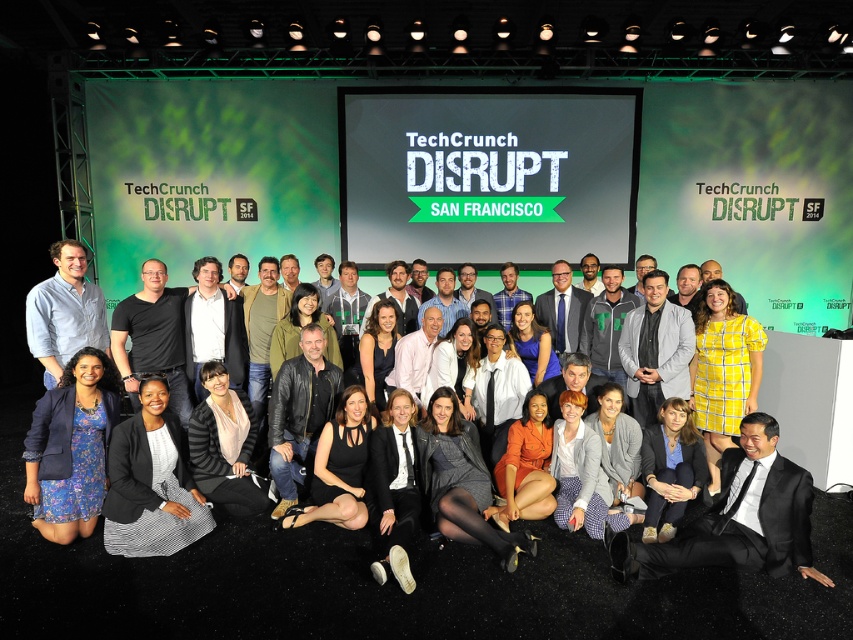
Does black satin suit at lower right appear on the right side of matte blue shirt at left?

Correct, you'll find black satin suit at lower right to the right of matte blue shirt at left.

Consider the image. Can you confirm if black satin suit at lower right is taller than matte blue shirt at left?

In fact, black satin suit at lower right may be shorter than matte blue shirt at left.

Between point (689, 548) and point (85, 252), which one is positioned in front?

Point (689, 548) is more forward.

The image size is (853, 640). Find the location of `black satin suit at lower right`. black satin suit at lower right is located at coordinates (738, 516).

Between point (693, 557) and point (68, 451), which one is positioned in front?

Point (693, 557)

Identify the location of black satin suit at lower right. (738, 516).

The width and height of the screenshot is (853, 640). Find the location of `black satin suit at lower right`. black satin suit at lower right is located at coordinates (738, 516).

Which is more to the left, gray fabric jacket at center or matte blue shirt at left?

From the viewer's perspective, matte blue shirt at left appears more on the left side.

Who is shorter, gray fabric jacket at center or matte blue shirt at left?

With less height is matte blue shirt at left.

Consider the image. Who is more distant from viewer, (631, 388) or (28, 316)?

The point (631, 388) is behind.

You are a GUI agent. You are given a task and a screenshot of the screen. Output one action in this format:
    pyautogui.click(x=<x>, y=<y>)
    Task: Click on the gray fabric jacket at center
    
    Given the screenshot: What is the action you would take?
    click(654, 349)